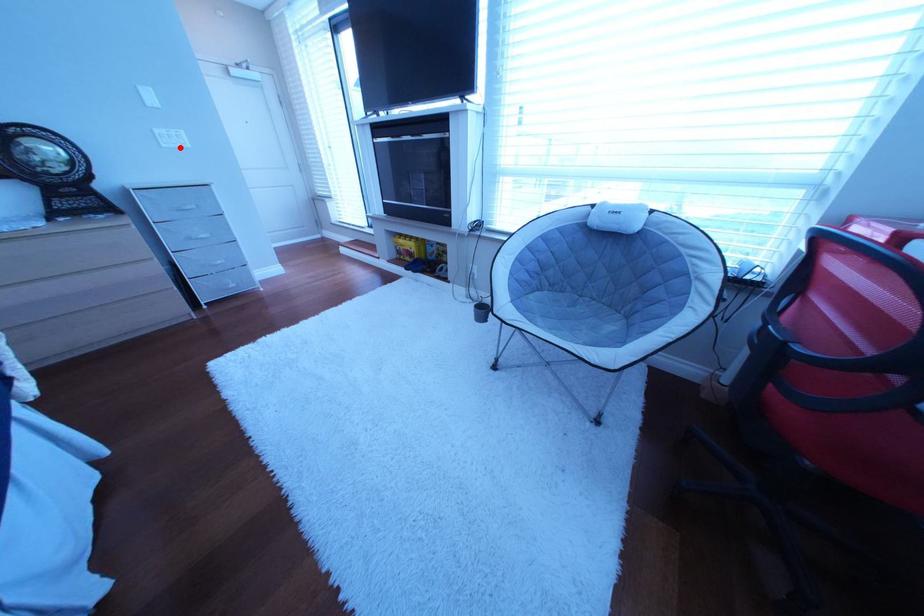
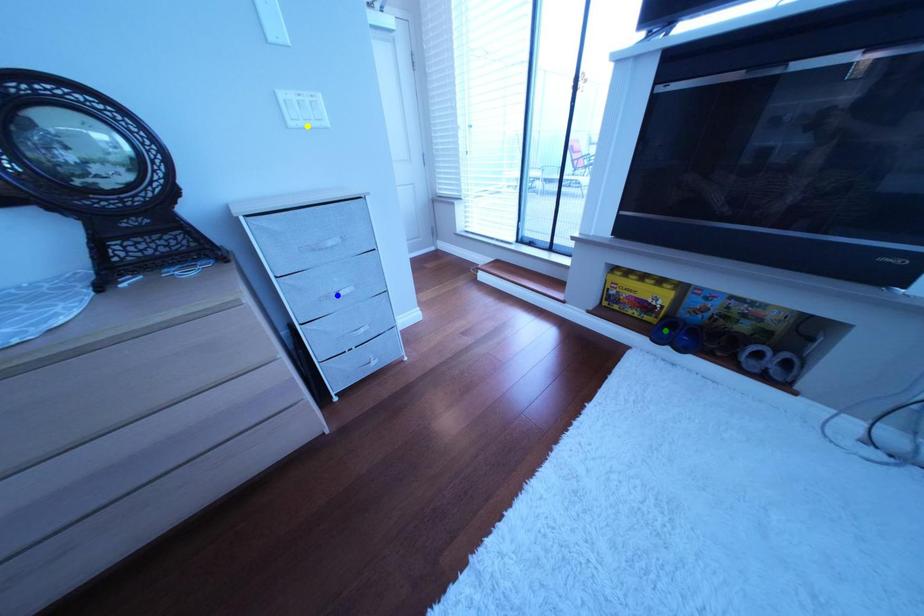
Question: I am providing you with two images of the same scene from different viewpoints. A red point is marked on the first image. You are given multiple points on the second image. In image 2, which mark is for the same physical point as the one in image 1?

Choices:
 (A) green point
 (B) yellow point
 (C) blue point

Answer: (B)